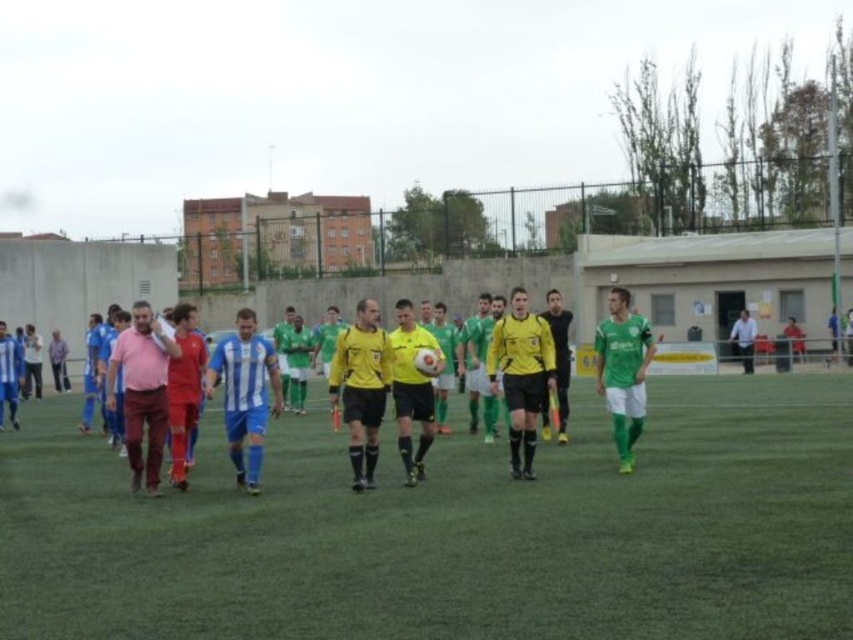
You are standing at the point with coordinates point [546,308] and want to walk to the point with coordinates point [91,499]. Is the destination point in front of you or behind you?

The point [91,499] is in front of point [546,308], so the destination point is in front of you.

You are a photographer positioned at the edge of the soccer field. You want to take a photo of both the yellow matte jersey at center and the yellow jersey at center. Which one will appear larger in your photo?

The yellow matte jersey at center will appear larger in the photo because it is closer to the viewer than the yellow jersey at center.